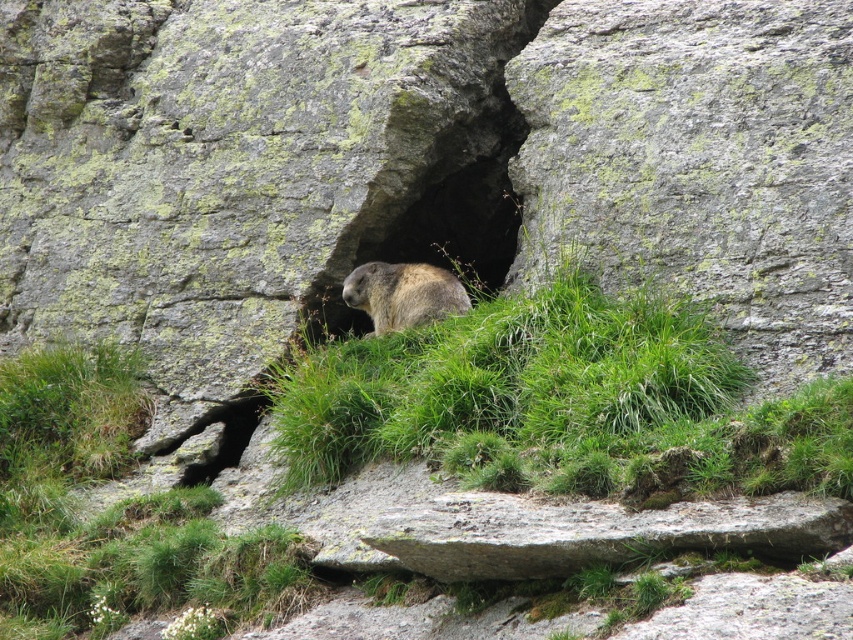
Question: Can you confirm if green grassy at center is positioned below brown fur at center?

Choices:
 (A) yes
 (B) no

Answer: (A)

Question: Which is nearer to the green grassy at center?

Choices:
 (A) brown fur at center
 (B) fuzzy brown bear at center

Answer: (B)

Question: Is green grassy at center closer to the viewer compared to fuzzy brown bear at center?

Choices:
 (A) no
 (B) yes

Answer: (B)

Question: Among these objects, which one is nearest to the camera?

Choices:
 (A) green grassy at center
 (B) fuzzy brown bear at center

Answer: (A)

Question: Does green grassy at center appear under fuzzy brown bear at center?

Choices:
 (A) yes
 (B) no

Answer: (A)

Question: Estimate the real-world distances between objects in this image. Which object is farther from the brown fur at center?

Choices:
 (A) fuzzy brown bear at center
 (B) green grassy at center

Answer: (B)